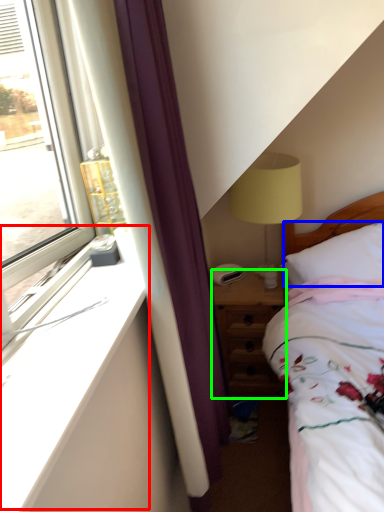
Question: Estimate the real-world distances between objects in this image. Which object is closer to window sill (highlighted by a red box), pillow (highlighted by a blue box) or nightstand (highlighted by a green box)?

Choices:
 (A) pillow
 (B) nightstand

Answer: (B)